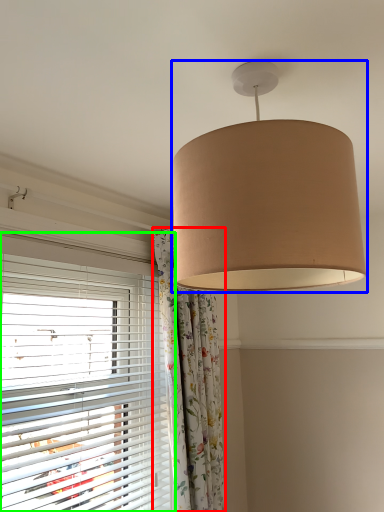
Question: Which object is the closest to the curtain (highlighted by a red box)? Choose among these: lamp (highlighted by a blue box) or window blind (highlighted by a green box).

Choices:
 (A) lamp
 (B) window blind

Answer: (B)